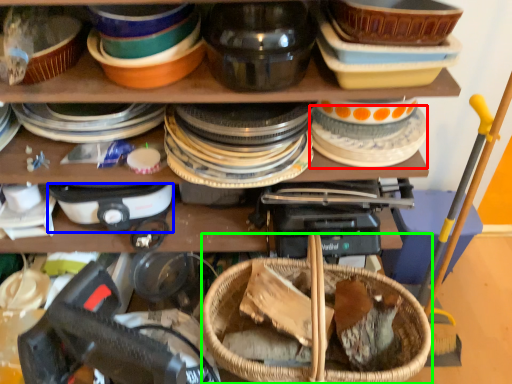
Question: Estimate the real-world distances between objects in this image. Which object is farther from tableware (highlighted by a red box), appliance (highlighted by a blue box) or basket (highlighted by a green box)?

Choices:
 (A) appliance
 (B) basket

Answer: (A)